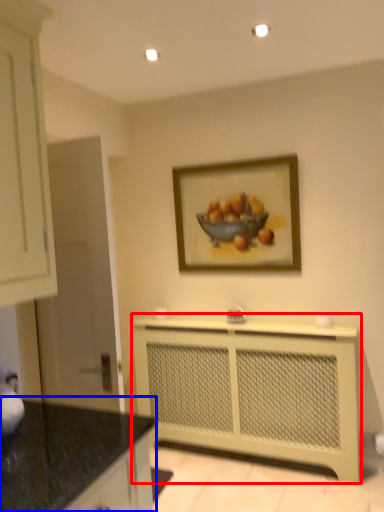
Question: Which point is further to the camera, counter (highlighted by a red box) or countertop (highlighted by a blue box)?

Choices:
 (A) counter
 (B) countertop

Answer: (A)